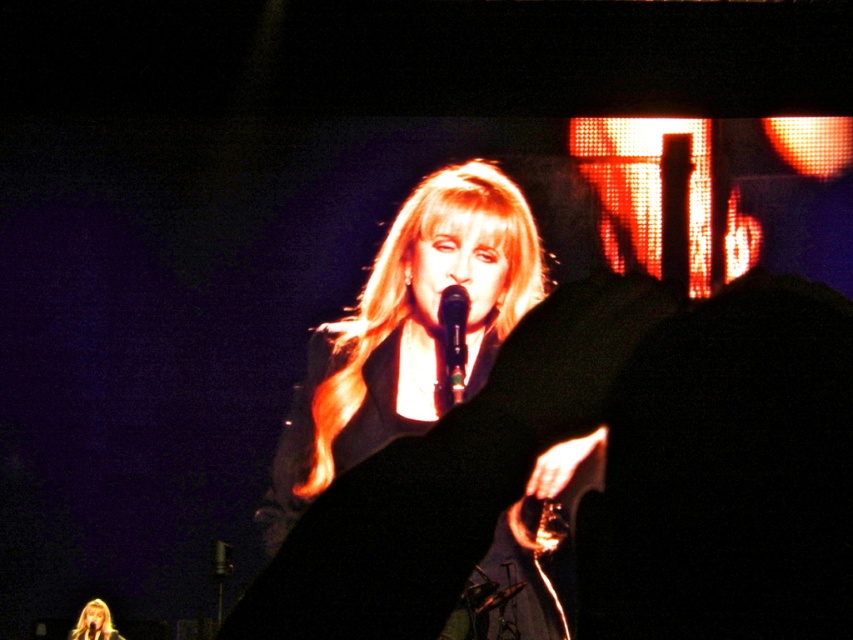
Consider the image. You are a photographer at the concert venue. You want to take a photo of the performer with the large screen in the background. The screen is located at point 0.5,0.5. Where should you position yourself relative to the blondehair at center to ensure the screen is visible behind the performer?

To capture the large screen in the background behind the blondehair at center, position yourself so that the performer is centered, aligning with the screen at point (426, 320). Since the blondehair at center is at point (408, 288), slightly adjust your position to the right and upward to frame the performer against the screen at (426, 320).

You are a photographer at the concert venue. You need to capture a photo of the blondehair at center and the shiny black microphone at center. Based on their sizes in the image, which one should you focus on first if you want to ensure both are in focus?

The blondehair at center is much taller than the shiny black microphone at center, so you should focus on the blondehair at center first to ensure both are in focus.

Consider the image. You are a stagehand at the concert venue and need to adjust the microphone stand. The performer is currently singing into the shiny black microphone at center. If you start moving straight towards the shiny black microphone at center from your current position at point [451,346], will you reach it directly without any obstacles?

The point [451,346] corresponds to the shiny black microphone at center, so moving straight towards it from that point would mean you are already at the microphone. There are no obstacles mentioned in the scene description, so you are already at the correct location.